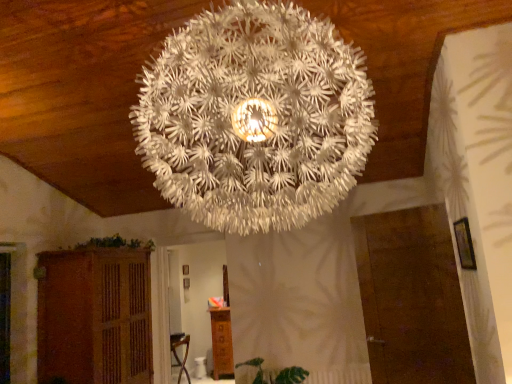
Question: Is wooden cabinet at lower center, which is the second furniture in left-to-right order, with green leafy plant at lower left, acting as the 2th plant starting from the bottom?

Choices:
 (A) yes
 (B) no

Answer: (B)

Question: Does wooden cabinet at lower center, which is the second furniture in left-to-right order, come behind green leafy plant at lower left, acting as the 2th plant starting from the bottom?

Choices:
 (A) yes
 (B) no

Answer: (A)

Question: From a real-world perspective, does wooden cabinet at lower center, which is the second furniture in left-to-right order, stand above green leafy plant at lower left, acting as the 2th plant starting from the bottom?

Choices:
 (A) yes
 (B) no

Answer: (B)

Question: Is green leafy plant at lower left, which is the second plant from right to left, inside wooden cabinet at lower center, which is the second furniture in left-to-right order?

Choices:
 (A) yes
 (B) no

Answer: (B)

Question: Considering the relative positions of wooden cabinet at lower center, which is the 1th furniture in right-to-left order, and green leafy plant at lower left, acting as the 2th plant starting from the bottom, in the image provided, is wooden cabinet at lower center, which is the 1th furniture in right-to-left order, to the left of green leafy plant at lower left, acting as the 2th plant starting from the bottom, from the viewer's perspective?

Choices:
 (A) yes
 (B) no

Answer: (B)

Question: Is wooden cabinet at lower center, which is counted as the 2th furniture, starting from the front, inside or outside of brown wooden cabinet at lower left, the first furniture from the front?

Choices:
 (A) outside
 (B) inside

Answer: (A)

Question: From the image's perspective, is wooden cabinet at lower center, which is the 1th furniture in right-to-left order, above or below brown wooden cabinet at lower left, the first furniture from the front?

Choices:
 (A) below
 (B) above

Answer: (A)

Question: Considering the positions of point (212, 342) and point (87, 274), is point (212, 342) closer or farther from the camera than point (87, 274)?

Choices:
 (A) farther
 (B) closer

Answer: (A)

Question: Based on their sizes in the image, would you say wooden cabinet at lower center, which is counted as the first furniture, starting from the back, is bigger or smaller than brown wooden cabinet at lower left, which appears as the 2th furniture when viewed from the back?

Choices:
 (A) big
 (B) small

Answer: (B)

Question: From the image's perspective, is green leafy plant at lower center, marked as the 1th plant in a right-to-left arrangement, located above or below wooden cabinet at lower center, which is counted as the first furniture, starting from the back?

Choices:
 (A) below
 (B) above

Answer: (B)

Question: Is point [287, 367] positioned closer to the camera than point [212, 370]?

Choices:
 (A) closer
 (B) farther

Answer: (A)

Question: Is green leafy plant at lower center, which ranks as the 2th plant in top-to-bottom order, inside or outside of wooden cabinet at lower center, which is the second furniture in left-to-right order?

Choices:
 (A) inside
 (B) outside

Answer: (B)

Question: Looking at their shapes, would you say green leafy plant at lower center, which ranks as the 2th plant in top-to-bottom order, is wider or thinner than wooden cabinet at lower center, which is counted as the first furniture, starting from the back?

Choices:
 (A) wide
 (B) thin

Answer: (B)

Question: In the image, is green leafy plant at lower left, which is the second plant from right to left, positioned in front of or behind wooden cabinet at lower center, which is counted as the first furniture, starting from the back?

Choices:
 (A) behind
 (B) front

Answer: (B)

Question: From a real-world perspective, is green leafy plant at lower left, which is the second plant from right to left, above or below wooden cabinet at lower center, which is counted as the 2th furniture, starting from the front?

Choices:
 (A) below
 (B) above

Answer: (B)